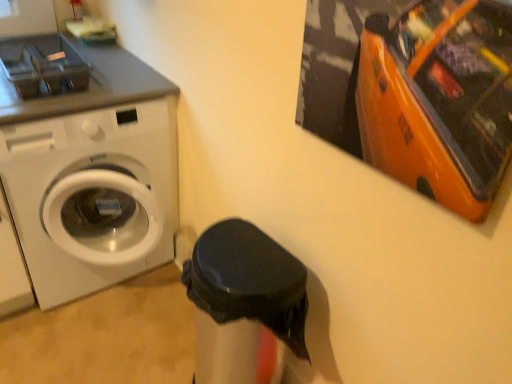
At what (x,y) coordinates should I click in order to perform the action: click on vacant space situated above black matte trash can at center (from a real-world perspective). Please return your answer as a coordinate pair (x, y). This screenshot has width=512, height=384. Looking at the image, I should click on (245, 256).